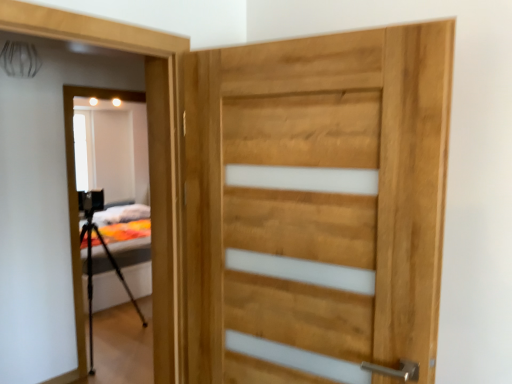
Question: In the image, is black matte tripod at left positioned in front of or behind natural wood door at center?

Choices:
 (A) behind
 (B) front

Answer: (A)

Question: From a real-world perspective, is black matte tripod at left above or below natural wood door at center?

Choices:
 (A) above
 (B) below

Answer: (B)

Question: Considering the positions of black matte tripod at left and natural wood door at center in the image, is black matte tripod at left taller or shorter than natural wood door at center?

Choices:
 (A) tall
 (B) short

Answer: (A)

Question: Is natural wood door at center bigger or smaller than black matte tripod at left?

Choices:
 (A) small
 (B) big

Answer: (A)

Question: From the image's perspective, relative to black matte tripod at left, is natural wood door at center above or below?

Choices:
 (A) below
 (B) above

Answer: (B)

Question: In terms of width, does natural wood door at center look wider or thinner when compared to black matte tripod at left?

Choices:
 (A) wide
 (B) thin

Answer: (B)

Question: Considering the positions of natural wood door at center and black matte tripod at left in the image, is natural wood door at center taller or shorter than black matte tripod at left?

Choices:
 (A) short
 (B) tall

Answer: (A)